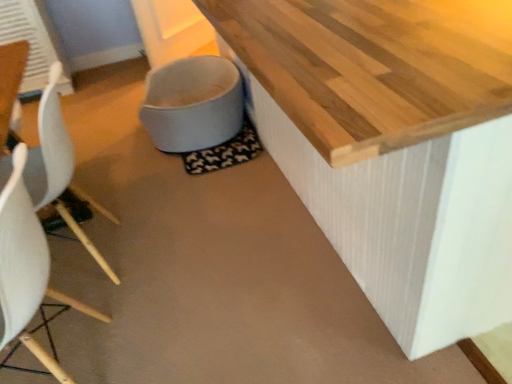
Question: Should I look upward or downward to see white fabric toilet bowl at lower center?

Choices:
 (A) down
 (B) up

Answer: (B)

Question: Does white matte chair at left, which is the first chair in front-to-back order, lie in front of white fabric toilet bowl at lower center?

Choices:
 (A) yes
 (B) no

Answer: (A)

Question: Is white matte chair at left, which is counted as the 2th chair, starting from the back, positioned with its back to white fabric toilet bowl at lower center?

Choices:
 (A) yes
 (B) no

Answer: (B)

Question: From a real-world perspective, is white matte chair at left, which is counted as the 2th chair, starting from the back, physically below white fabric toilet bowl at lower center?

Choices:
 (A) yes
 (B) no

Answer: (B)

Question: Is white matte chair at left, which is counted as the 2th chair, starting from the back, outside of white fabric toilet bowl at lower center?

Choices:
 (A) no
 (B) yes

Answer: (B)

Question: From the image's perspective, is white matte chair at left, which is the first chair in front-to-back order, on white fabric toilet bowl at lower center?

Choices:
 (A) yes
 (B) no

Answer: (B)

Question: Can you confirm if white matte chair at left, which is the first chair in front-to-back order, is bigger than white fabric toilet bowl at lower center?

Choices:
 (A) yes
 (B) no

Answer: (B)

Question: Is white matte chair at left, which is counted as the 2th chair, starting from the back, wider than white plastic chair at left, acting as the 2th chair starting from the front?

Choices:
 (A) no
 (B) yes

Answer: (A)

Question: From a real-world perspective, is white matte chair at left, which is counted as the 2th chair, starting from the back, positioned under white plastic chair at left, acting as the 2th chair starting from the front, based on gravity?

Choices:
 (A) yes
 (B) no

Answer: (B)

Question: Considering the relative sizes of white matte chair at left, which is counted as the 2th chair, starting from the back, and white plastic chair at left, the 1th chair in the back-to-front sequence, in the image provided, is white matte chair at left, which is counted as the 2th chair, starting from the back, shorter than white plastic chair at left, the 1th chair in the back-to-front sequence,?

Choices:
 (A) no
 (B) yes

Answer: (B)

Question: Is white matte chair at left, which is the first chair in front-to-back order, aimed at white plastic chair at left, acting as the 2th chair starting from the front?

Choices:
 (A) no
 (B) yes

Answer: (A)

Question: From a real-world perspective, does white matte chair at left, which is counted as the 2th chair, starting from the back, stand above white plastic chair at left, acting as the 2th chair starting from the front?

Choices:
 (A) yes
 (B) no

Answer: (A)

Question: Does white plastic chair at left, acting as the 2th chair starting from the front, have a larger size compared to white fabric toilet bowl at lower center?

Choices:
 (A) no
 (B) yes

Answer: (B)